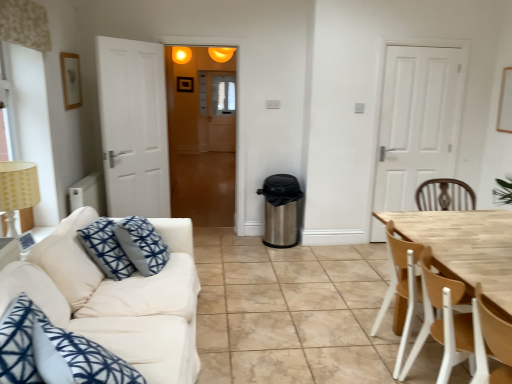
Question: From the image's perspective, is beige fabric lampshade at left above or below light brown wood chair at right, the second chair from the back?

Choices:
 (A) below
 (B) above

Answer: (B)

Question: In the image, is beige fabric lampshade at left positioned in front of or behind light brown wood chair at right, which is counted as the 1th chair, starting from the front?

Choices:
 (A) front
 (B) behind

Answer: (B)

Question: Which of these objects is positioned farthest from the white matte door at right?

Choices:
 (A) beige fabric lampshade at left
 (B) wooden chair at right, which is the 2th chair from front to back
 (C) light brown wood chair at right, the second chair from the back
 (D) white fabric couch at left
 (E) translucent wooden door at center

Answer: (A)

Question: Estimate the real-world distances between objects in this image. Which object is farther from the white fabric couch at left?

Choices:
 (A) wooden chair at right, which is the 2th chair from front to back
 (B) translucent wooden door at center
 (C) light brown wood chair at right, which is counted as the 1th chair, starting from the front
 (D) beige fabric lampshade at left
 (E) matte orange light fixture at upper center

Answer: (B)